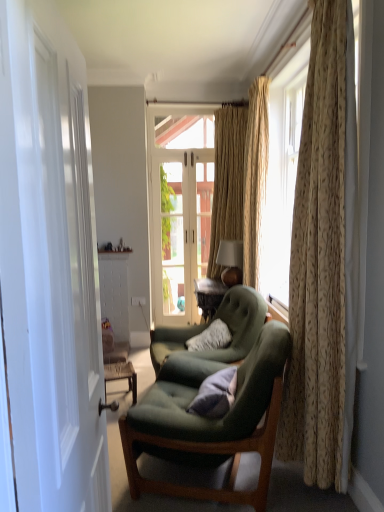
I want to click on blank space situated above white glass door at center (from a real-world perspective), so click(x=178, y=148).